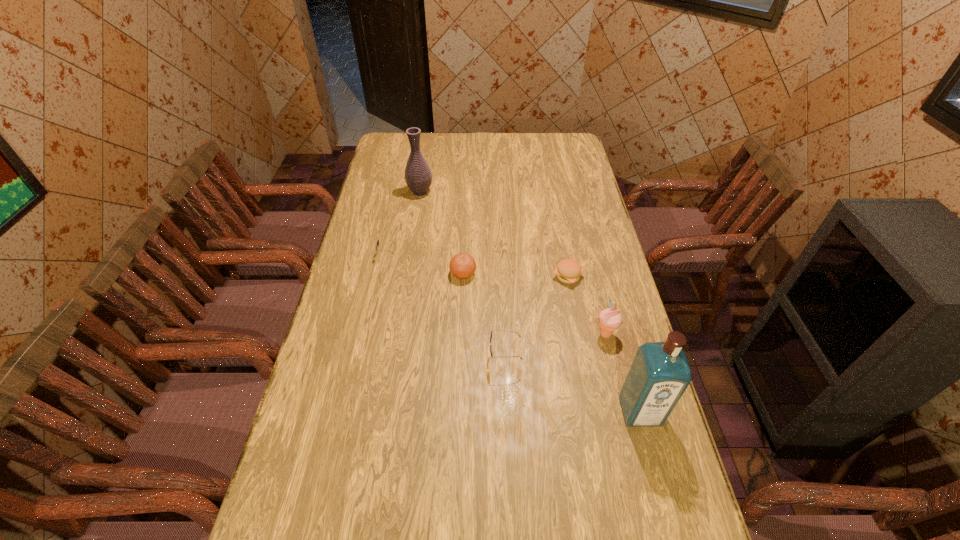
At what (x,y) coordinates should I click in order to perform the action: click on the farther sunglasses. Please return your answer as a coordinate pair (x, y). This screenshot has width=960, height=540. Looking at the image, I should click on (377, 243).

Image resolution: width=960 pixels, height=540 pixels. I want to click on the shorter sunglasses, so click(x=377, y=243).

This screenshot has width=960, height=540. I want to click on the nearer sunglasses, so click(493, 329).

Where is `the right sunglasses`? The height and width of the screenshot is (540, 960). the right sunglasses is located at coordinates (493, 329).

Image resolution: width=960 pixels, height=540 pixels. I want to click on the farthest object, so click(418, 176).

This screenshot has height=540, width=960. Identify the location of vase. (418, 176).

Locate an element on the screen. This screenshot has width=960, height=540. the fifth shortest object is located at coordinates (610, 319).

Identify the location of clementine. (462, 266).

In order to click on the nearest object in this screenshot , I will do `click(660, 373)`.

This screenshot has width=960, height=540. Identify the location of hamburger. (568, 271).